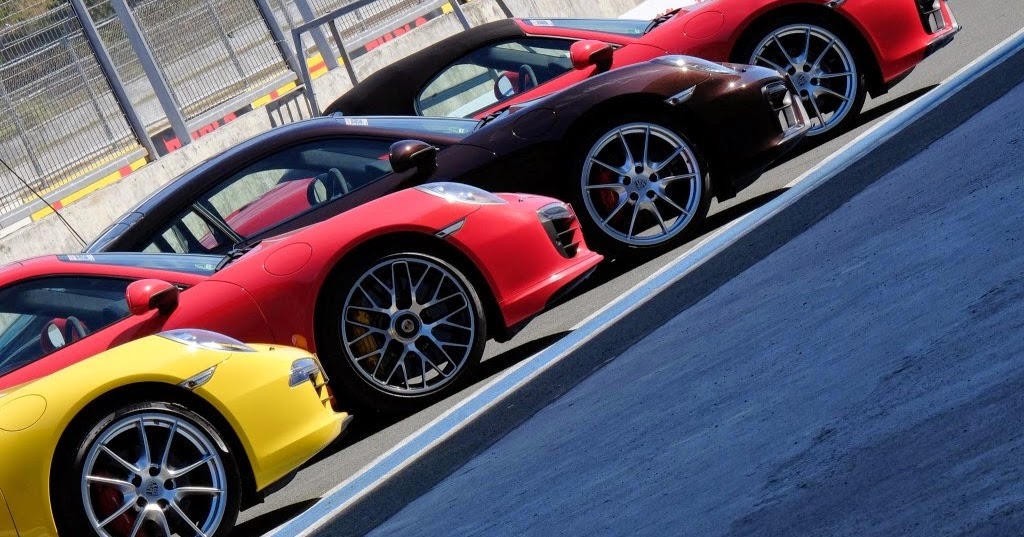
This screenshot has width=1024, height=537. I want to click on mirrors, so click(x=579, y=54), click(x=408, y=150), click(x=315, y=188), click(x=509, y=84), click(x=147, y=290), click(x=52, y=332).